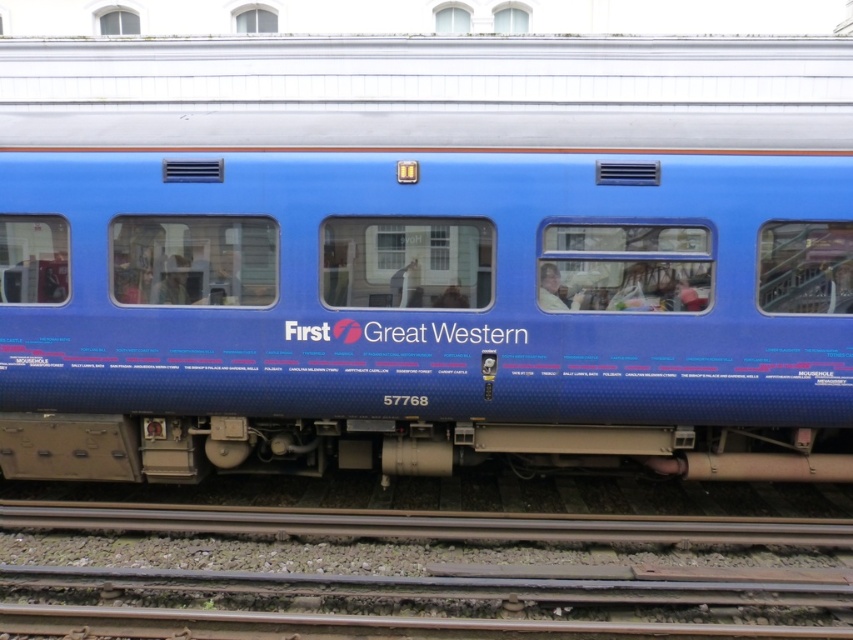
Can you confirm if blue glossy train car at center is bigger than smooth metal track at bottom?

Yes.

Where is `blue glossy train car at center`? The width and height of the screenshot is (853, 640). blue glossy train car at center is located at coordinates (424, 292).